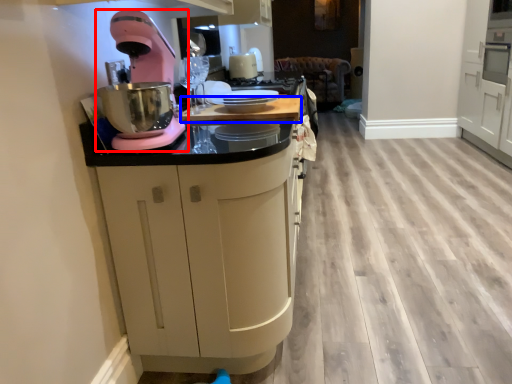
Question: Which of the following is the closest to the observer, home appliance (highlighted by a red box) or counter top (highlighted by a blue box)?

Choices:
 (A) home appliance
 (B) counter top

Answer: (A)